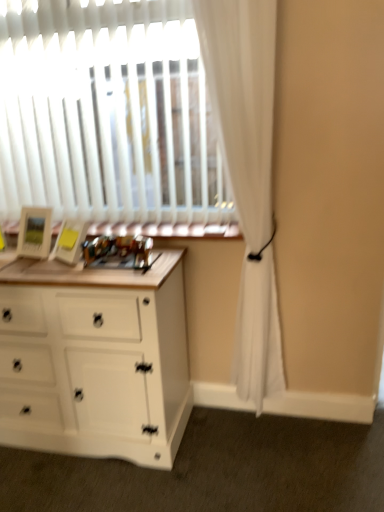
Measure the distance between point (91, 421) and camera.

6.03 feet.

The image size is (384, 512). I want to click on white sheer curtain at right, so pyautogui.click(x=247, y=173).

Where is `wooden frame at center`? The width and height of the screenshot is (384, 512). wooden frame at center is located at coordinates (169, 230).

Is white matte chest of drawers at left facing away from wooden frame at center?

No, wooden frame at center is not at the back of white matte chest of drawers at left.

How many degrees apart are the facing directions of white matte chest of drawers at left and wooden frame at center?

The angular difference between white matte chest of drawers at left and wooden frame at center is 0.341 degrees.

Is white matte chest of drawers at left positioned behind wooden frame at center?

No.

Can you confirm if white matte chest of drawers at left is taller than wooden frame at center?

Correct, white matte chest of drawers at left is much taller as wooden frame at center.

Who is taller, white sheer curtain at right or wooden frame at center?

Standing taller between the two is white sheer curtain at right.

Where is `curtain located on the right of wooden frame at center`? This screenshot has height=512, width=384. curtain located on the right of wooden frame at center is located at coordinates (247, 173).

From the picture: Which of these two, white sheer curtain at right or wooden frame at center, is thinner?

With smaller width is white sheer curtain at right.

From a real-world perspective, is white sheer curtain at right on top of white matte chest of drawers at left?

Yes, from a real-world perspective, white sheer curtain at right is on top of white matte chest of drawers at left.

Considering the sizes of white sheer curtain at right and white matte chest of drawers at left in the image, is white sheer curtain at right wider or thinner than white matte chest of drawers at left?

Clearly, white sheer curtain at right has less width compared to white matte chest of drawers at left.

Which object is positioned more to the left, white sheer curtain at right or white matte chest of drawers at left?

white matte chest of drawers at left is more to the left.

Is white sheer curtain at right closer to camera compared to white matte chest of drawers at left?

That is True.

Consider the image. From a real-world perspective, is wooden frame at center on white matte chest of drawers at left?

Yes, from a real-world perspective, wooden frame at center is above white matte chest of drawers at left.

From the picture: Between wooden frame at center and white matte chest of drawers at left, which one appears on the right side from the viewer's perspective?

From the viewer's perspective, wooden frame at center appears more on the right side.

Can white matte chest of drawers at left be found inside wooden frame at center?

No, white matte chest of drawers at left is located outside of wooden frame at center.

Image resolution: width=384 pixels, height=512 pixels. Find the location of `window sill above the white matte chest of drawers at left (from a real-world perspective)`. window sill above the white matte chest of drawers at left (from a real-world perspective) is located at coordinates click(169, 230).

Is wooden frame at center at the right side of white sheer curtain at right?

In fact, wooden frame at center is to the left of white sheer curtain at right.

From the image's perspective, is wooden frame at center on top of white sheer curtain at right?

Yes, from the image's perspective, wooden frame at center is over white sheer curtain at right.

From a real-world perspective, between wooden frame at center and white sheer curtain at right, who is vertically higher?

white sheer curtain at right, from a real-world perspective.

Considering the sizes of wooden frame at center and white sheer curtain at right in the image, is wooden frame at center taller or shorter than white sheer curtain at right?

Clearly, wooden frame at center is shorter compared to white sheer curtain at right.

Can you confirm if white matte chest of drawers at left is smaller than white sheer curtain at right?

No, white matte chest of drawers at left is not smaller than white sheer curtain at right.

Is white matte chest of drawers at left facing towards white sheer curtain at right?

No, white matte chest of drawers at left is not aimed at white sheer curtain at right.

Which is correct: white matte chest of drawers at left is inside white sheer curtain at right, or outside of it?

white matte chest of drawers at left cannot be found inside white sheer curtain at right.

Where is `the chest of drawers directly beneath the white sheer curtain at right (from a real-world perspective)`? the chest of drawers directly beneath the white sheer curtain at right (from a real-world perspective) is located at coordinates (95, 359).

Where is `window sill that is on the right side of white matte chest of drawers at left`? window sill that is on the right side of white matte chest of drawers at left is located at coordinates (169, 230).

The width and height of the screenshot is (384, 512). Identify the location of window sill that is on the left side of white sheer curtain at right. (169, 230).

From the image, which object appears to be nearer to wooden frame at center, white sheer curtain at right or white matte chest of drawers at left?

white sheer curtain at right lies closer to wooden frame at center than the other object.

Considering their positions, is white matte chest of drawers at left positioned further to wooden frame at center than white sheer curtain at right?

white matte chest of drawers at left lies further to wooden frame at center than the other object.

Looking at the image, which one is located closer to white sheer curtain at right, wooden frame at center or white matte chest of drawers at left?

Based on the image, wooden frame at center appears to be nearer to white sheer curtain at right.

Considering their positions, is white matte chest of drawers at left positioned closer to white sheer curtain at right than wooden frame at center?

Based on the image, wooden frame at center appears to be nearer to white sheer curtain at right.

Estimate the real-world distances between objects in this image. Which object is closer to white matte chest of drawers at left, white sheer curtain at right or wooden frame at center?

wooden frame at center lies closer to white matte chest of drawers at left than the other object.

From the image, which object appears to be farther from white matte chest of drawers at left, wooden frame at center or white sheer curtain at right?

The object further to white matte chest of drawers at left is white sheer curtain at right.

Find the location of a particular element. window sill situated between white matte chest of drawers at left and white sheer curtain at right from left to right is located at coordinates (169, 230).